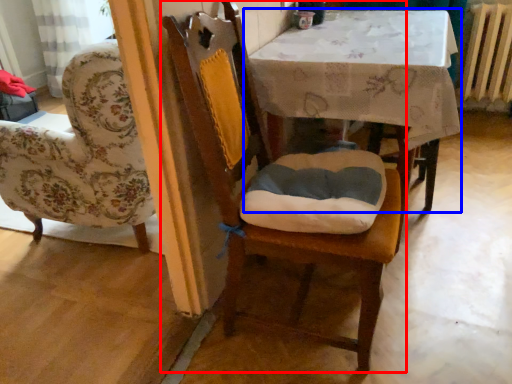
Question: Which object appears closest to the camera in this image, chair (highlighted by a red box) or table (highlighted by a blue box)?

Choices:
 (A) chair
 (B) table

Answer: (A)